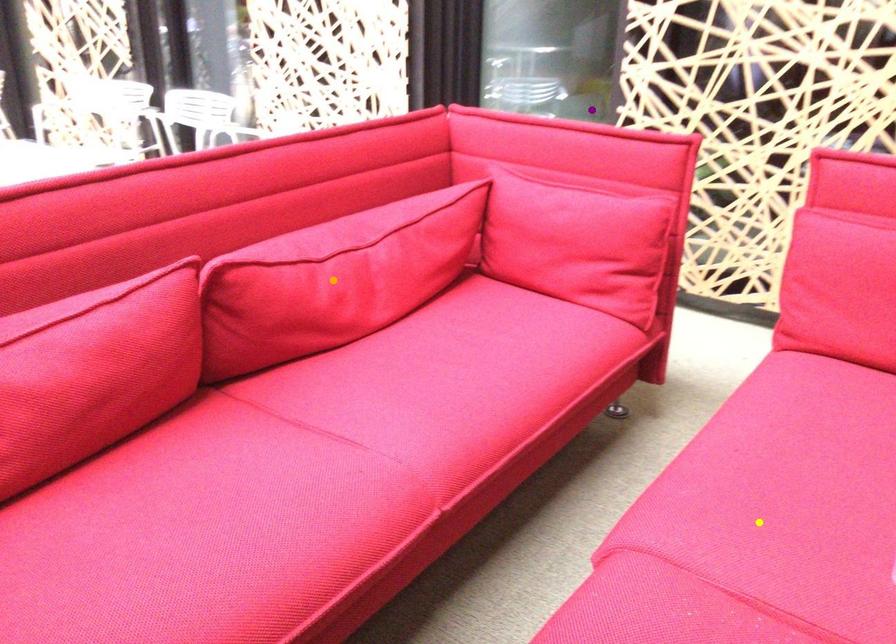
Order these from nearest to farthest:
purple point, orange point, yellow point

yellow point
orange point
purple point